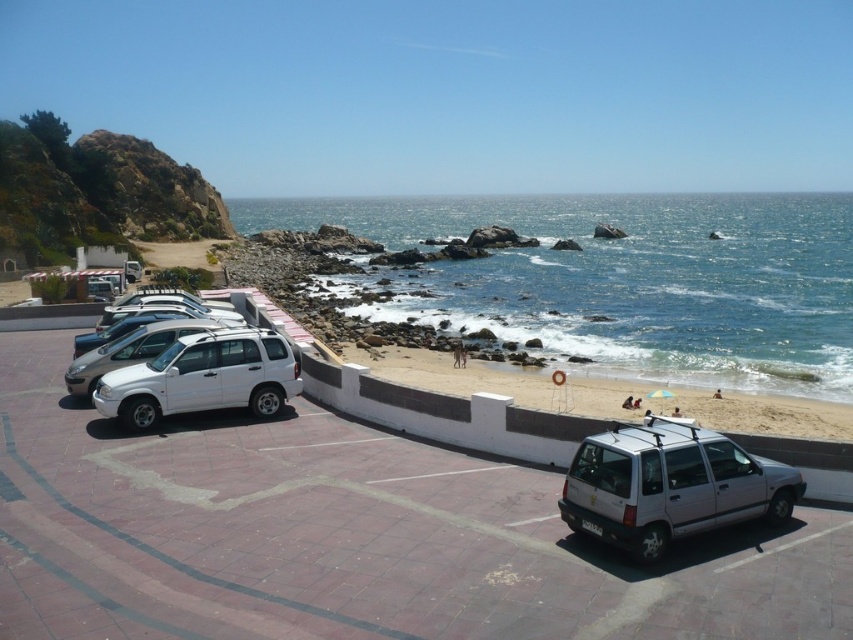
You are a pedestrian standing at the edge of the parking area near the concrete wall. You see the silver metallic minivan at lower right and the white matte suv at left. Which vehicle is closer to the beach?

The silver metallic minivan at lower right is closer to the beach because it is positioned to the right of the white matte suv at left, and since the beach is at the lower edge of the parking area, the minivan being on the right side would be nearer to the beach edge.

You are a photographer trying to capture the entire scene in one shot. Given that the white matte suv at left is smaller than the blue water at lower right, which object should you focus on to ensure both are visible in the frame?

Since the blue water at lower right is larger in size than the white matte suv at left, you should focus on the blue water at lower right to ensure both objects are visible in the frame.